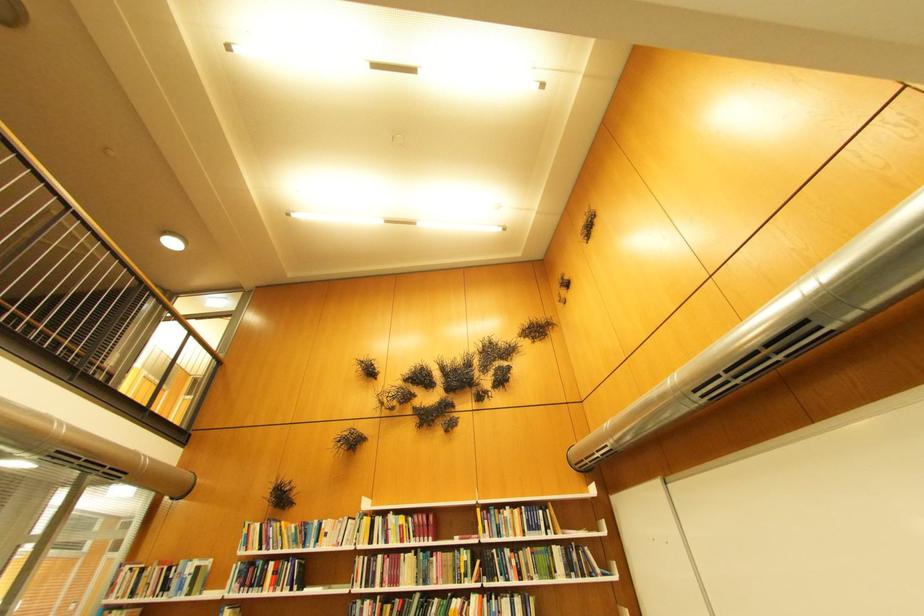
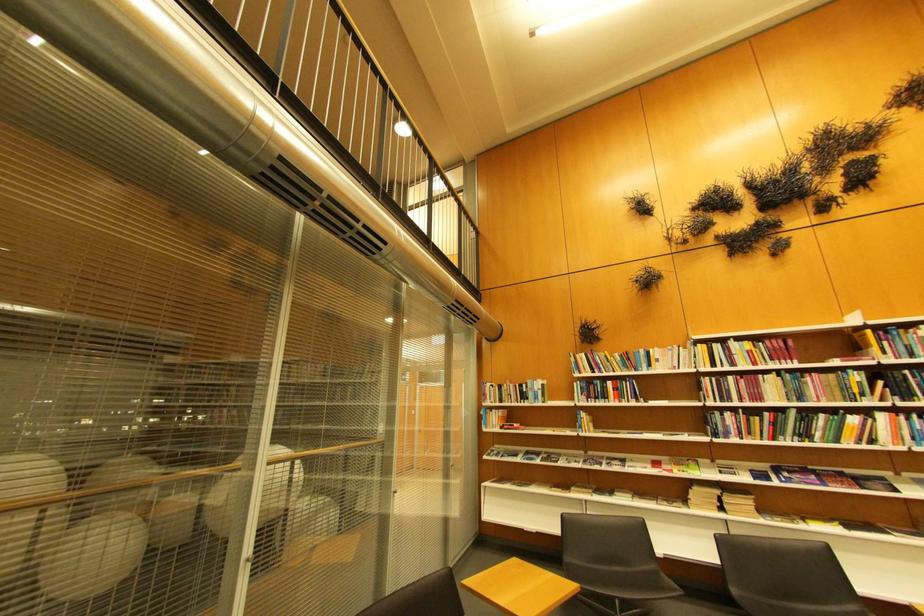
Where in the second image is the point corresponding to [191,564] from the first image?

(540, 383)